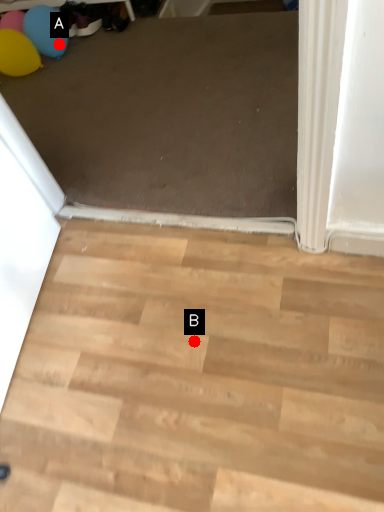
Question: Two points are circled on the image, labeled by A and B beside each circle. Which point appears closest to the camera in this image?

Choices:
 (A) A is closer
 (B) B is closer

Answer: (B)